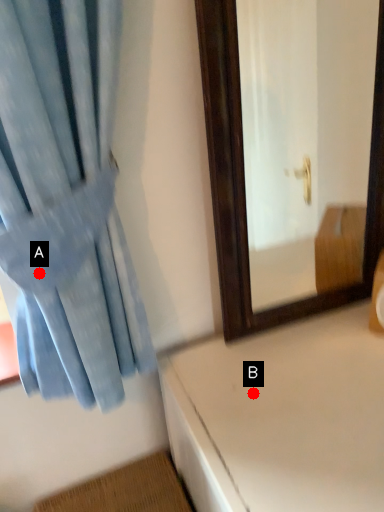
Question: Two points are circled on the image, labeled by A and B beside each circle. Which point is closer to the camera taking this photo?

Choices:
 (A) A is closer
 (B) B is closer

Answer: (A)